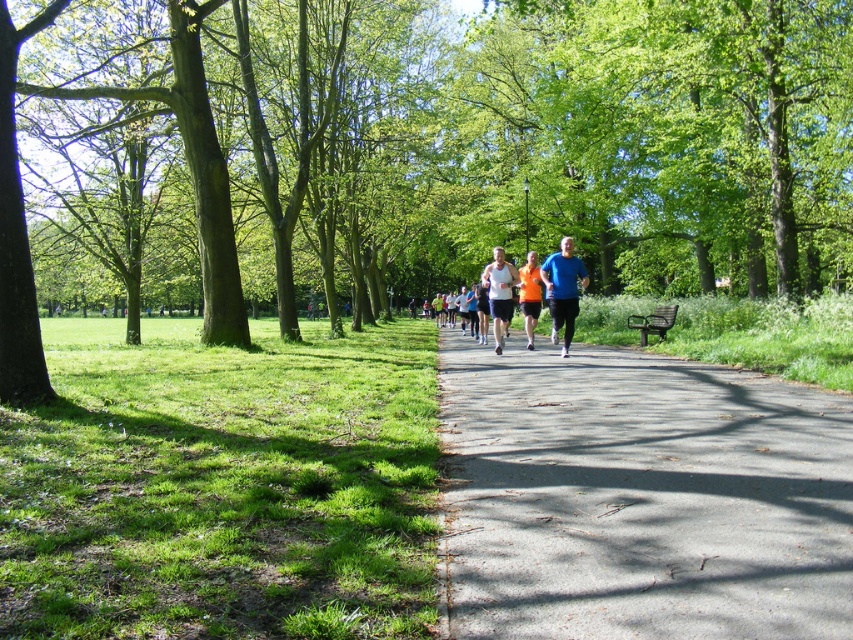
You are a photographer standing on the grassy area next to the path. You want to take a photo of both the blue fabric shirt at center and orange fabric shirt at center so that both are clearly visible. Which shirt should you focus on to ensure the smaller one is in sharp focus?

The blue fabric shirt at center is smaller than the orange fabric shirt at center, so you should focus on the blue fabric shirt at center to ensure it is in sharp focus.

You are a pedestrian standing on the asphalt road at center. You see a blue fabric shirt at center ahead of you. Can you tell me which object is taller from your perspective?

The blue fabric shirt at center is taller than the asphalt road at center.

You are standing at the point marked by the coordinates point (640, 497) in the park. What type of surface are you currently standing on?

The point (640, 497) corresponds to the asphalt road at center, so you are standing on an asphalt road.